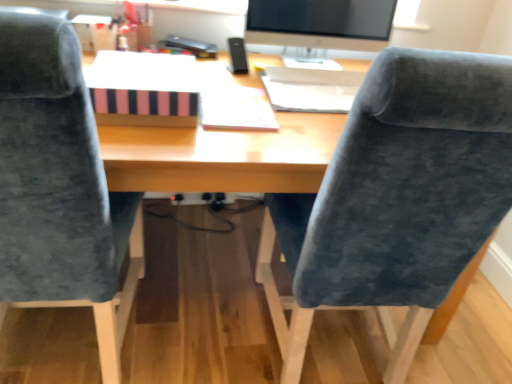
Identify the location of vacant space to the left of black plastic remote at center. (219, 63).